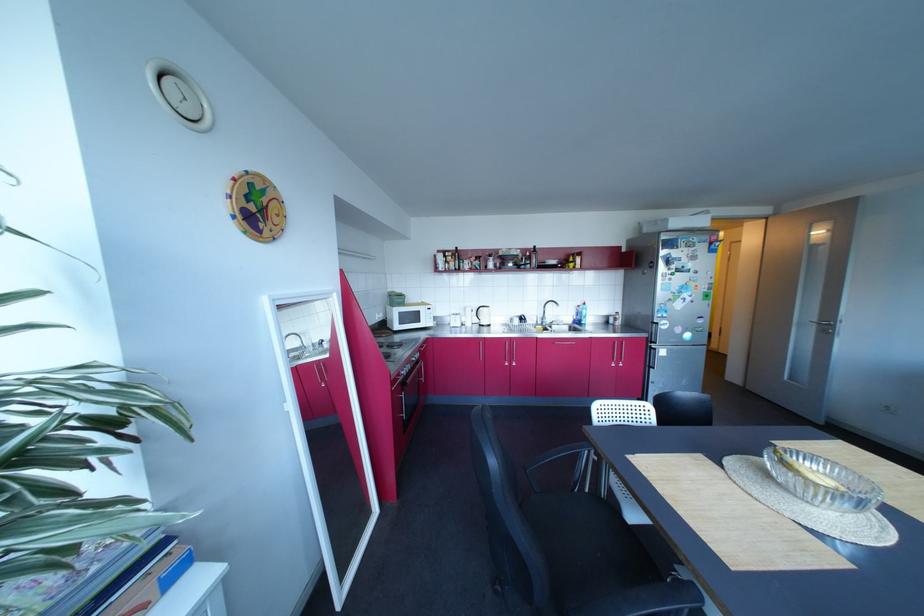
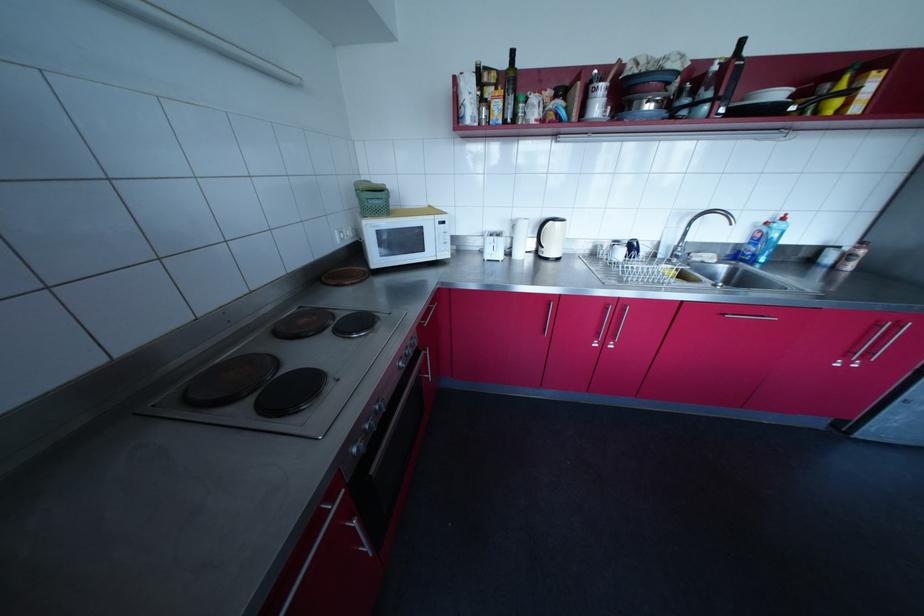
Question: The images are taken continuously from a first-person perspective. In which direction are you moving?

Choices:
 (A) Left
 (B) Right
 (C) Forward
 (D) Backward

Answer: (C)